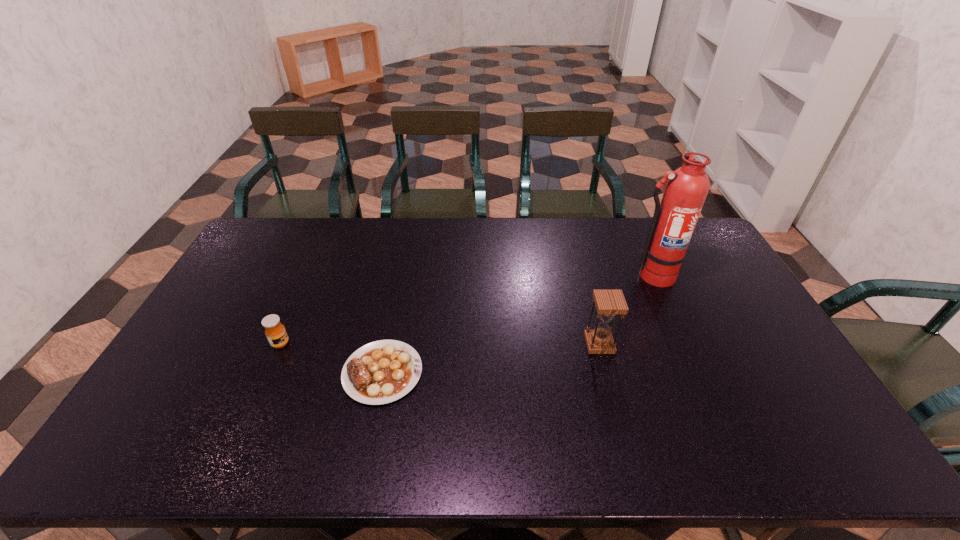
At what (x,y) coordinates should I click in order to perform the action: click on free space located 0.330m on the front-facing side of the second shortest object. Please return your answer as a coordinate pair (x, y). This screenshot has width=960, height=540. Looking at the image, I should click on (403, 343).

Locate an element on the screen. The height and width of the screenshot is (540, 960). vacant space located 0.190m on the left of the second object from left to right is located at coordinates (x=274, y=373).

The width and height of the screenshot is (960, 540). In order to click on vacant region at the far edge of the desktop in this screenshot , I will do `click(528, 241)`.

You are a GUI agent. You are given a task and a screenshot of the screen. Output one action in this format:
    pyautogui.click(x=<x>, y=<y>)
    Task: Click on the vacant space at the near edge of the desktop
    This screenshot has width=960, height=540.
    Given the screenshot: What is the action you would take?
    pyautogui.click(x=281, y=455)

Image resolution: width=960 pixels, height=540 pixels. I want to click on free space at the left edge of the desktop, so click(238, 267).

The height and width of the screenshot is (540, 960). I want to click on vacant space at the near left corner, so click(x=177, y=455).

At what (x,y) coordinates should I click in order to perform the action: click on vacant space at the near right corner of the desktop. Please return your answer as a coordinate pair (x, y). This screenshot has width=960, height=540. Looking at the image, I should click on (801, 440).

The width and height of the screenshot is (960, 540). I want to click on free point between the steak and the second tallest object, so point(491,358).

Locate an element on the screen. empty location between the rightmost object and the second shortest object is located at coordinates (467, 309).

Locate an element on the screen. empty space that is in between the honey and the farthest object is located at coordinates (467, 309).